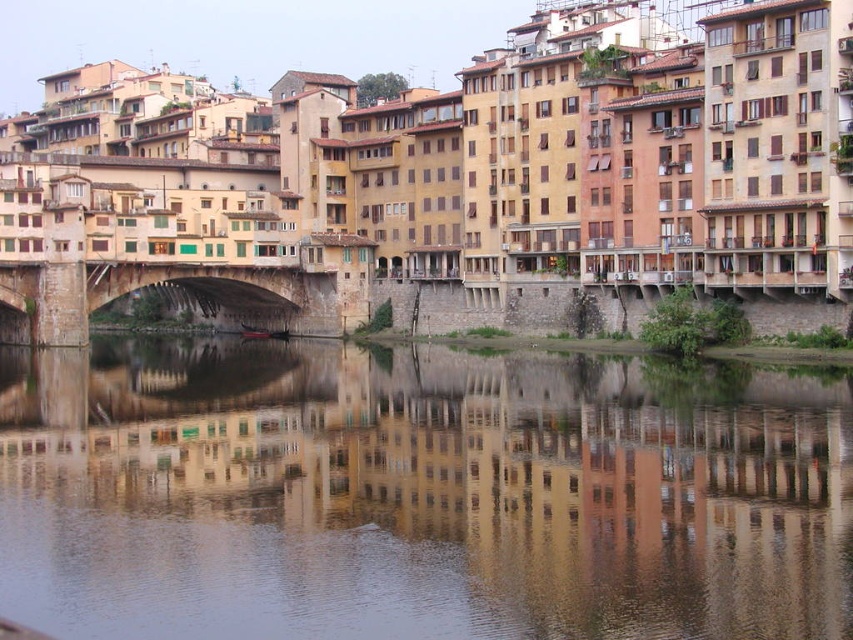
Question: Can you confirm if smooth water at center is positioned to the right of stone arch bridge at center?

Choices:
 (A) yes
 (B) no

Answer: (A)

Question: Among these objects, which one is nearest to the camera?

Choices:
 (A) stone arch bridge at center
 (B) smooth water at center

Answer: (B)

Question: Considering the relative positions of smooth water at center and stone arch bridge at center in the image provided, where is smooth water at center located with respect to stone arch bridge at center?

Choices:
 (A) right
 (B) left

Answer: (A)

Question: Which of the following is the farthest from the observer?

Choices:
 (A) stone arch bridge at center
 (B) smooth water at center

Answer: (A)

Question: Is smooth water at center bigger than stone arch bridge at center?

Choices:
 (A) no
 (B) yes

Answer: (B)